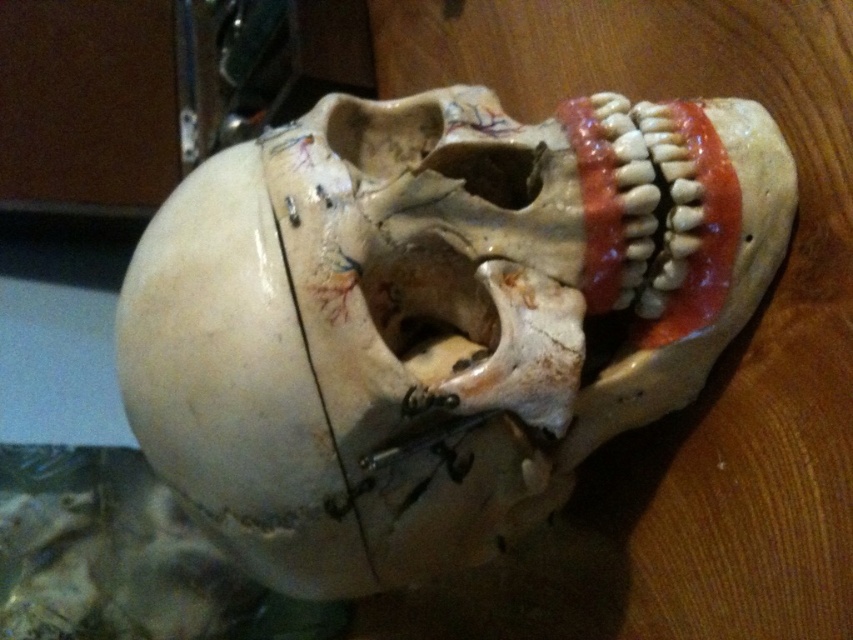
Is white matte skull at center shorter than smooth porcelain teeth at right?

No, white matte skull at center is not shorter than smooth porcelain teeth at right.

Is point (566, 332) closer to camera compared to point (573, 141)?

Yes, point (566, 332) is closer to viewer.

Identify the location of white matte skull at center. (434, 316).